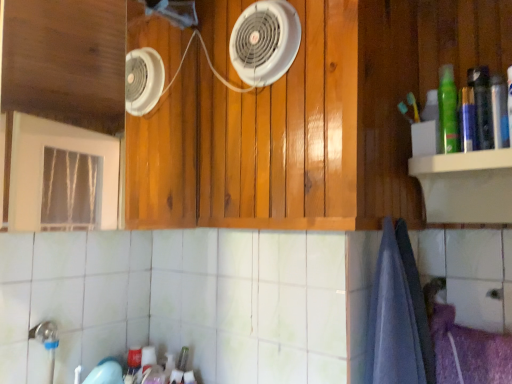
Question: Is wooden cabinet at center positioned far away from white plastic fan at upper center?

Choices:
 (A) yes
 (B) no

Answer: (B)

Question: Is the depth of wooden cabinet at center less than that of white plastic fan at upper center?

Choices:
 (A) yes
 (B) no

Answer: (A)

Question: From a real-world perspective, does wooden cabinet at center stand above white plastic fan at upper center?

Choices:
 (A) yes
 (B) no

Answer: (B)

Question: Considering the relative positions of wooden cabinet at center and white plastic fan at upper center in the image provided, is wooden cabinet at center to the left of white plastic fan at upper center from the viewer's perspective?

Choices:
 (A) yes
 (B) no

Answer: (A)

Question: Is wooden cabinet at center oriented towards white plastic fan at upper center?

Choices:
 (A) no
 (B) yes

Answer: (B)

Question: From a real-world perspective, is wooden cabinet at center below white plastic fan at upper center?

Choices:
 (A) yes
 (B) no

Answer: (A)

Question: Is white plastic fan at upper center touching wooden cabinet at center?

Choices:
 (A) yes
 (B) no

Answer: (B)

Question: Is white plastic fan at upper center oriented away from wooden cabinet at center?

Choices:
 (A) yes
 (B) no

Answer: (A)

Question: From a real-world perspective, is white plastic fan at upper center under wooden cabinet at center?

Choices:
 (A) no
 (B) yes

Answer: (A)

Question: From the image's perspective, is white plastic fan at upper center on wooden cabinet at center?

Choices:
 (A) yes
 (B) no

Answer: (A)

Question: Does white plastic fan at upper center have a lesser width compared to wooden cabinet at center?

Choices:
 (A) no
 (B) yes

Answer: (A)

Question: Can you confirm if white plastic fan at upper center is positioned to the right of wooden cabinet at center?

Choices:
 (A) no
 (B) yes

Answer: (B)

Question: Is green matte bottle at upper right a part of white plastic fan at upper center?

Choices:
 (A) yes
 (B) no

Answer: (B)